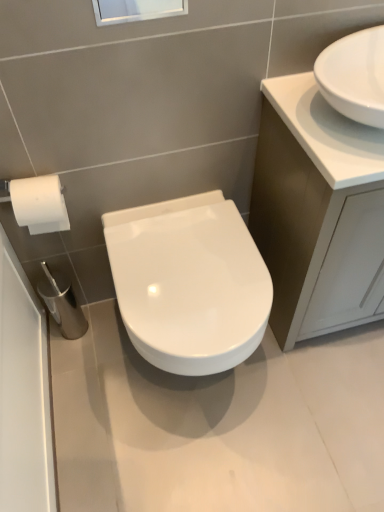
Where is `vacant space to the left of white glossy toilet at center`? This screenshot has height=512, width=384. vacant space to the left of white glossy toilet at center is located at coordinates (94, 375).